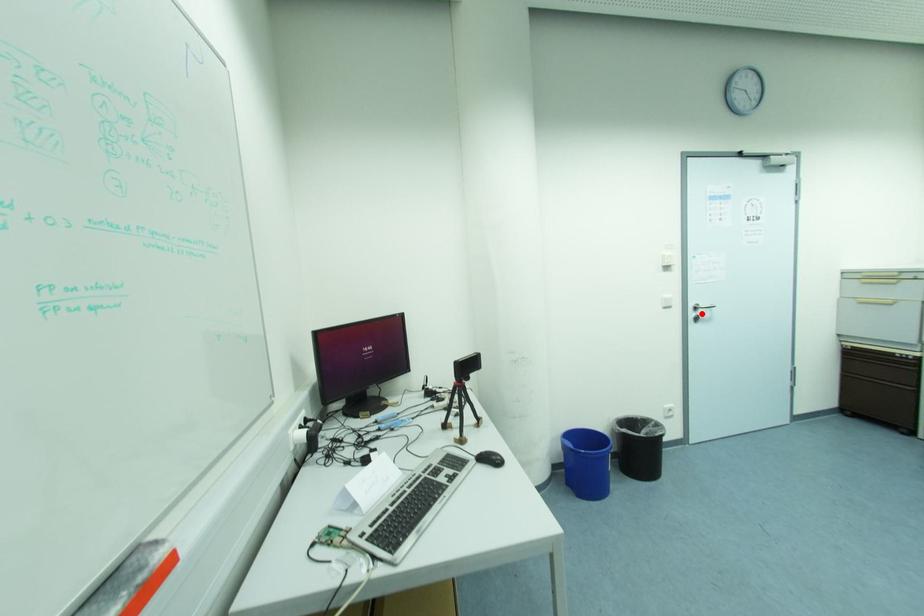
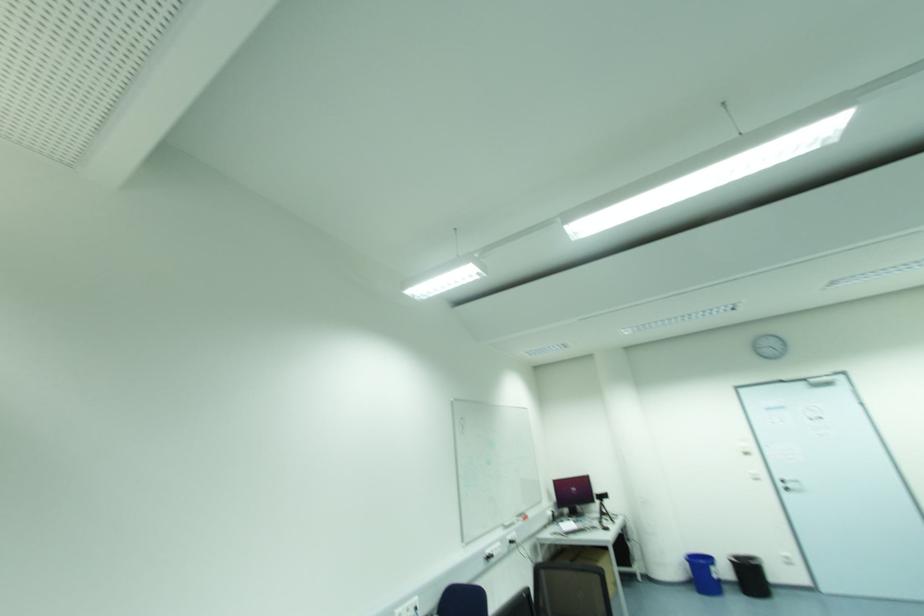
Locate, in the second image, the point that corresponds to the highlighted location in the first image.

(789, 485)